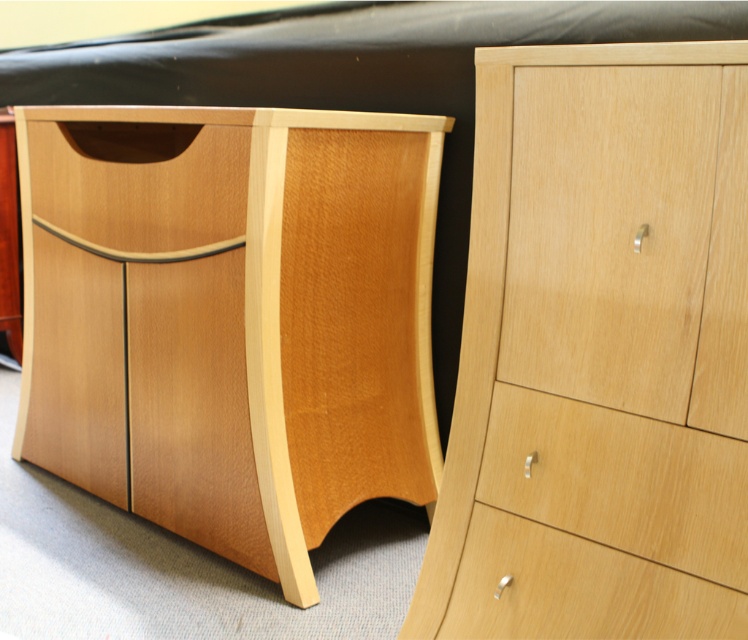
Is light brown wood drawer at center right smaller than light wood drawer at center?

Correct, light brown wood drawer at center right occupies less space than light wood drawer at center.

Between light brown wood drawer at center right and light wood drawer at center, which one appears on the right side from the viewer's perspective?

light brown wood drawer at center right

Which is in front, point (726, 524) or point (610, 564)?

Point (726, 524) is more forward.

I want to click on light brown wood drawer at center right, so click(619, 481).